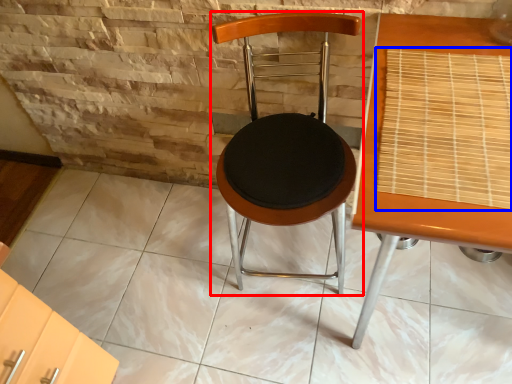
Question: Which object appears closest to the camera in this image, chair (highlighted by a red box) or mat (highlighted by a blue box)?

Choices:
 (A) chair
 (B) mat

Answer: (B)